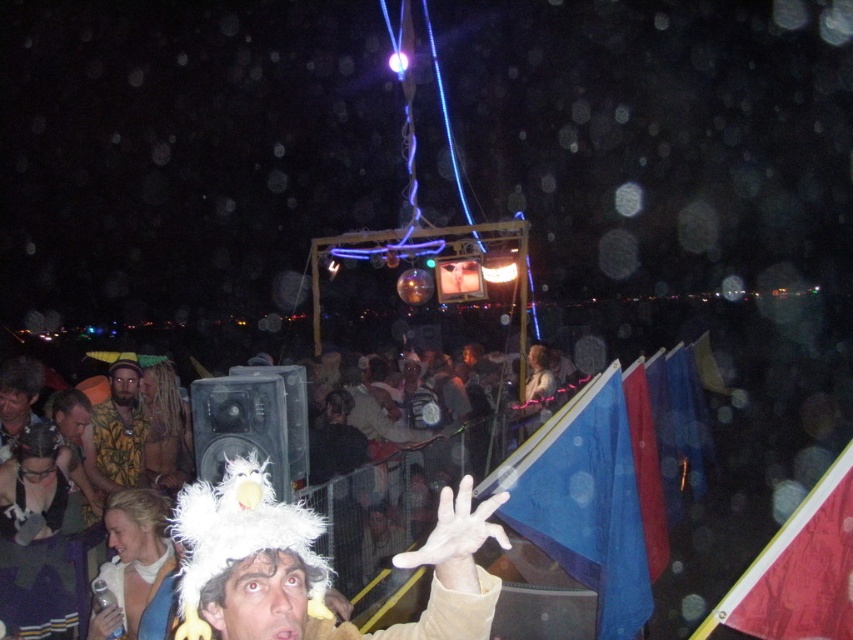
You are standing at the center of the image and want to hand a gift to the person wearing the white fluffy hat at lower center. According to the spatial coordinates provided, in which direction should you move to reach their location?

The white fluffy hat at lower center is located at point 0.883 on the x axis and 0.369 on the y axis. Since you are at the center, you should move to the right and slightly downward to reach the white fluffy hat at lower center.

You are standing in the crowd at the festival and see the white fluffy hat at lower center. If you want to touch it, how many steps do you think you need to take? Assume each step is about 3 feet.

The white fluffy hat at lower center is 6.44 feet away from the viewer. Since each step is about 3 feet, you would need to take approximately 2 steps to reach it.

You are a photographer at the festival scene. You want to capture a photo that includes the point at coordinates point (584, 502). Which object should you focus on to ensure the point is in the frame?

The point (584, 502) is on the blue fabric flag at upper right, so you should focus on the blue fabric flag at upper right to include the point in the frame.